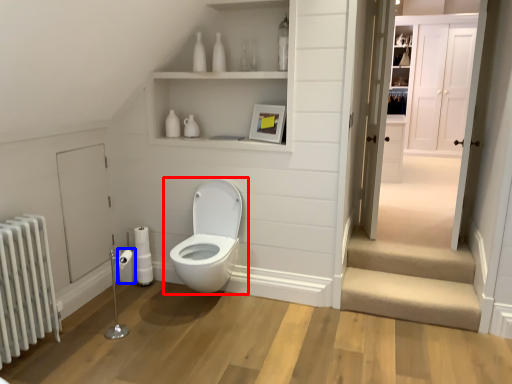
Question: Which object is closer to the camera taking this photo, toilet (highlighted by a red box) or toilet paper (highlighted by a blue box)?

Choices:
 (A) toilet
 (B) toilet paper

Answer: (A)